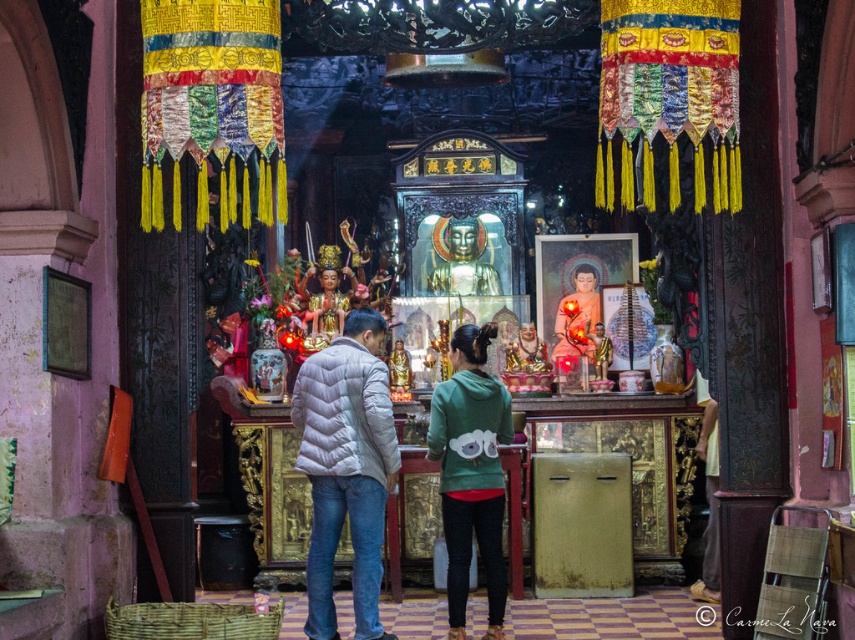
You are a photographer inside the temple and want to capture both the white quilted jacket at center and the green fleece jacket at center in a single shot. Based on their heights, which jacket will appear smaller in the photo?

The white quilted jacket at center will appear smaller in the photo because it has a lesser height compared to the green fleece jacket at center.

You are a photographer planning to take a photo of the two people at the temple altar. You need to ensure that both the green fleece jacket at center and the matte green hoodie at center are clearly visible in the frame. Since you want to highlight the height difference between them, which person should you position closer to the camera to make the height difference more apparent?

To emphasize the height difference between the green fleece jacket at center and the matte green hoodie at center, position the person wearing the green fleece jacket at center closer to the camera. Since it is taller, placing it nearer will make the height difference more noticeable.